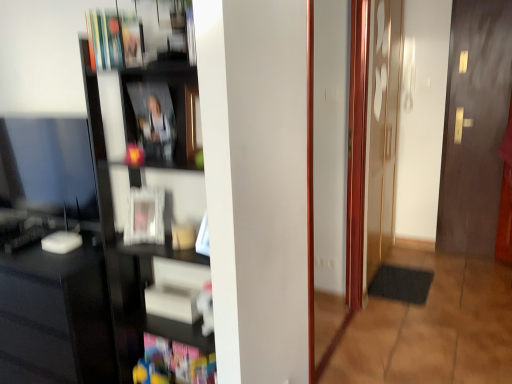
What are the coordinates of `empty space that is ontop of white matte book at center, which appears as the 6th book when viewed from the top` in the screenshot? It's located at (185, 287).